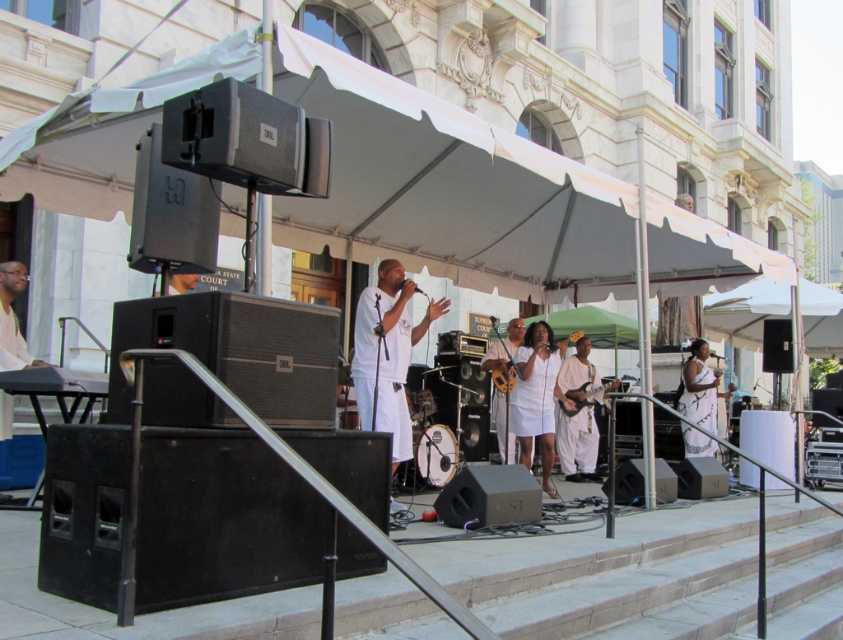
Question: Which object is farther from the camera taking this photo?

Choices:
 (A) white cotton shirt at center
 (B) white matte t-shirt at center

Answer: (A)

Question: Among these objects, which one is nearest to the camera?

Choices:
 (A) wooden electric guitar at center
 (B) white cotton shirt at center
 (C) white fabric guitar at center
 (D) white silk dress at right

Answer: (C)

Question: Is white matte/soft robe at center further to camera compared to white silk dress at right?

Choices:
 (A) yes
 (B) no

Answer: (B)

Question: Observing the image, what is the correct spatial positioning of white matte dress at center in reference to white silk dress at right?

Choices:
 (A) above
 (B) below

Answer: (B)

Question: Which of these objects is positioned closest to the white matte/soft robe at center?

Choices:
 (A) wooden electric guitar at center
 (B) white matte t-shirt at center
 (C) white matte dress at center

Answer: (B)

Question: From the image, what is the correct spatial relationship of white matte/soft robe at center in relation to white fabric guitar at center?

Choices:
 (A) above
 (B) below

Answer: (A)